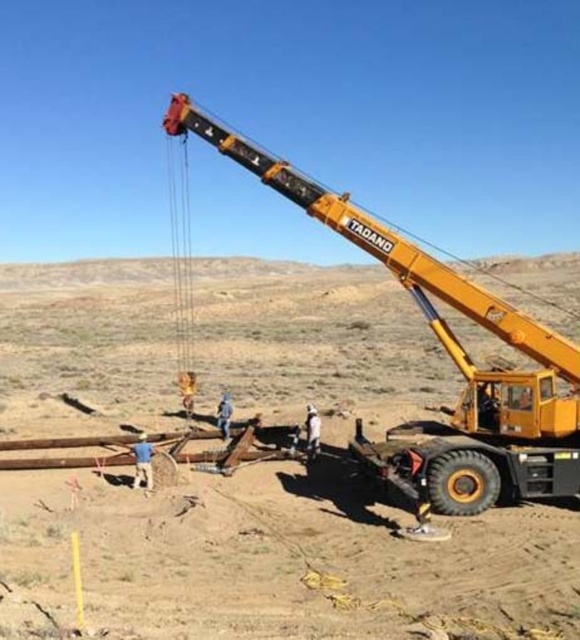
Question: Among these objects, which one is nearest to the camera?

Choices:
 (A) dirt field at center
 (B) yellow metallic crane at upper right

Answer: (A)

Question: Does dirt field at center have a smaller size compared to yellow metallic crane at upper right?

Choices:
 (A) no
 (B) yes

Answer: (A)

Question: Which point appears farthest from the camera in this image?

Choices:
 (A) (240, 508)
 (B) (575, 348)

Answer: (B)

Question: Does dirt field at center have a smaller size compared to yellow metallic crane at upper right?

Choices:
 (A) no
 (B) yes

Answer: (A)

Question: Considering the relative positions of dirt field at center and yellow metallic crane at upper right in the image provided, where is dirt field at center located with respect to yellow metallic crane at upper right?

Choices:
 (A) right
 (B) left

Answer: (B)

Question: Which point is closer to the camera taking this photo?

Choices:
 (A) (245, 164)
 (B) (414, 548)

Answer: (B)